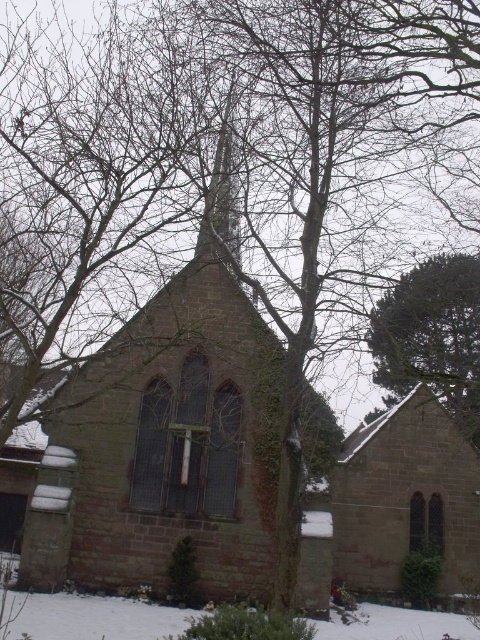
You are standing in front of the brown stone chapel at center and want to take a photo of the smooth stone spire at center. Since the spire is part of the chapel, where should you position yourself relative to the chapel to capture the spire in your shot?

The brown stone chapel at center is positioned under the smooth stone spire at center, so you should position yourself in front of the chapel at a lower angle to look up towards the spire.

You are standing at the point marked by coordinates point (165, 445) in the image. Based on the scene description, what structure are you directly in front of?

The point (165, 445) indicates the brown stone chapel at center, so you are directly in front of the brown stone chapel at center.

You are standing at the point marked as point (x=165, y=445). What structure are you directly in front of?

The brown stone chapel at center is located at point (x=165, y=445), so you are directly in front of the brown stone chapel at center.